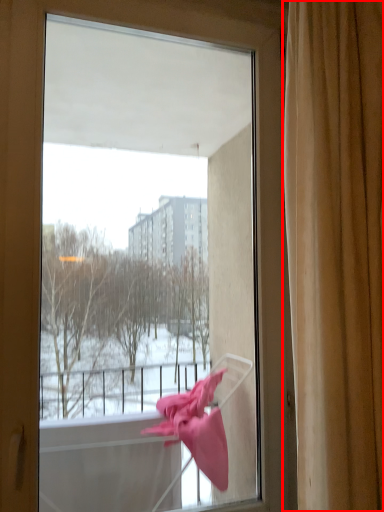
Question: From the image's perspective, what is the correct spatial relationship of curtain (annotated by the red box) in relation to window?

Choices:
 (A) above
 (B) below

Answer: (A)